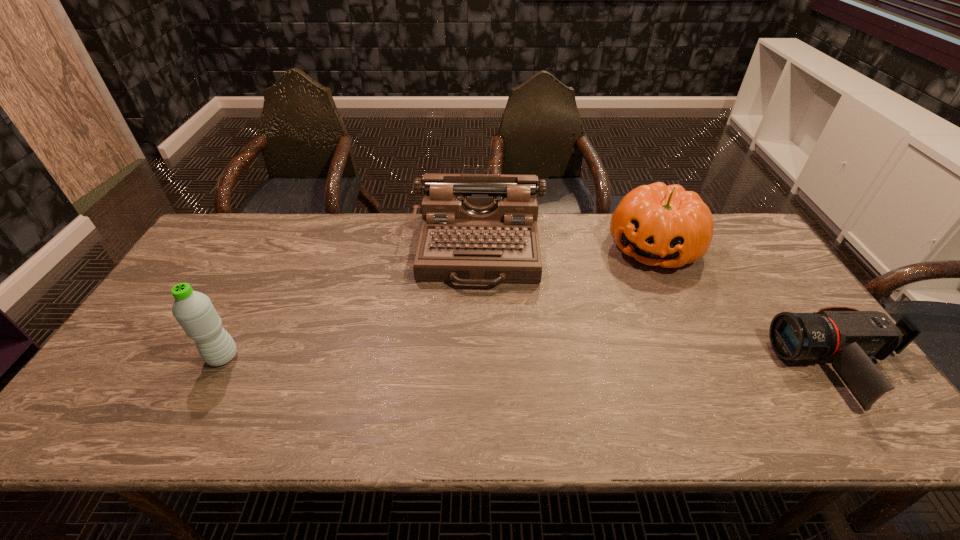
Where is `free location that satisfies the following two spatial constraints: 1. on the front side of the third object from left to right; 2. on the lens of the camcorder`? The height and width of the screenshot is (540, 960). free location that satisfies the following two spatial constraints: 1. on the front side of the third object from left to right; 2. on the lens of the camcorder is located at coordinates (708, 367).